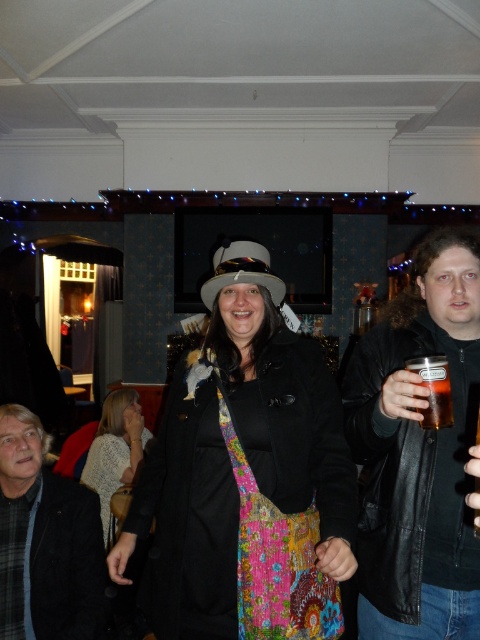
Question: Does dark gray woolen jacket at center appear on the left side of translucent plastic cup at right?

Choices:
 (A) yes
 (B) no

Answer: (A)

Question: Among these points, which one is farthest from the camera?

Choices:
 (A) (120, 436)
 (B) (262, 280)
 (C) (388, 417)
 (D) (239, 260)

Answer: (A)

Question: Which object is farther from the camera taking this photo?

Choices:
 (A) dark gray woolen jacket at center
 (B) white felt cowboy hat at center

Answer: (A)

Question: Among these objects, which one is farthest from the camera?

Choices:
 (A) white knit sweater at lower left
 (B) leather jacket at right

Answer: (A)

Question: Does matte black coat at center have a smaller size compared to white knit sweater at lower left?

Choices:
 (A) yes
 (B) no

Answer: (B)

Question: Does matte black coat at center come behind translucent plastic cup at right?

Choices:
 (A) no
 (B) yes

Answer: (A)